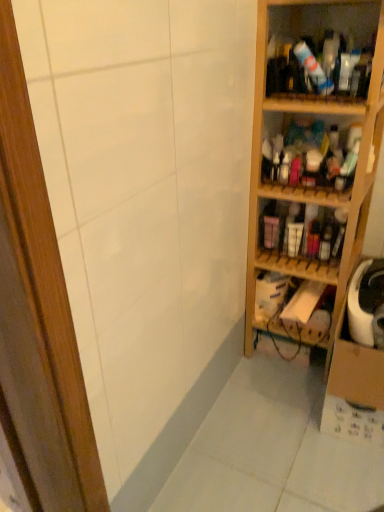
How much space does matte plastic bottles at center right, which appears as the fourth shelf when viewed from the top, occupy horizontally?

24.85 centimeters.

Image resolution: width=384 pixels, height=512 pixels. In order to click on translucent plastic bottles at upper right, which is counted as the fifth shelf, starting from the bottom in this screenshot , I will do tap(318, 42).

Image resolution: width=384 pixels, height=512 pixels. What are the coordinates of `wooden shelf at right, marked as the fifth shelf in a top-to-bottom arrangement` in the screenshot? It's located at (300, 312).

This screenshot has width=384, height=512. What do you see at coordinates (300, 312) in the screenshot? I see `wooden shelf at right, marked as the fifth shelf in a top-to-bottom arrangement` at bounding box center [300, 312].

At what (x,y) coordinates should I click in order to perform the action: click on wooden shelf at right, the 3th shelf in the top-to-bottom sequence. Please return your answer as a coordinate pair (x, y). This screenshot has width=384, height=512. Looking at the image, I should click on (311, 165).

Does point (267, 204) appear closer or farther from the camera than point (375, 88)?

Clearly, point (267, 204) is more distant from the camera than point (375, 88).

Which of these two, matte plastic bottles at center right, the 2th shelf in the bottom-to-top sequence, or wooden shelf at right, positioned as the third shelf in bottom-to-top order, stands taller?

With more height is wooden shelf at right, positioned as the third shelf in bottom-to-top order.

From a real-world perspective, is matte plastic bottles at center right, which appears as the fourth shelf when viewed from the top, located beneath wooden shelf at right, the 3th shelf in the top-to-bottom sequence?

Yes, from a real-world perspective, matte plastic bottles at center right, which appears as the fourth shelf when viewed from the top, is under wooden shelf at right, the 3th shelf in the top-to-bottom sequence.

Is point (326, 255) farther from camera compared to point (340, 56)?

Yes, point (326, 255) is farther from viewer.

Is matte plastic bottles at center right, which appears as the fourth shelf when viewed from the top, positioned with its back to translucent plastic bottles at upper right, which is counted as the fifth shelf, starting from the bottom?

No, matte plastic bottles at center right, which appears as the fourth shelf when viewed from the top, is not facing the opposite direction of translucent plastic bottles at upper right, which is counted as the fifth shelf, starting from the bottom.

Between matte plastic bottles at center right, the 2th shelf in the bottom-to-top sequence, and translucent plastic bottles at upper right, which is counted as the fifth shelf, starting from the bottom, which one has larger width?

translucent plastic bottles at upper right, which is counted as the fifth shelf, starting from the bottom, is wider.

Is wooden shelves at right, which appears as the second shelf when viewed from the top, at the right side of translucent plastic bottles at upper right, arranged as the 1th shelf when viewed from the top?

Incorrect, wooden shelves at right, which appears as the second shelf when viewed from the top, is not on the right side of translucent plastic bottles at upper right, arranged as the 1th shelf when viewed from the top.

Can you see wooden shelves at right, the 4th shelf in the bottom-to-top sequence, touching translucent plastic bottles at upper right, which is counted as the fifth shelf, starting from the bottom?

There is a gap between wooden shelves at right, the 4th shelf in the bottom-to-top sequence, and translucent plastic bottles at upper right, which is counted as the fifth shelf, starting from the bottom.

From a real-world perspective, is wooden shelves at right, the 4th shelf in the bottom-to-top sequence, located beneath translucent plastic bottles at upper right, arranged as the 1th shelf when viewed from the top?

Yes, from a real-world perspective, wooden shelves at right, the 4th shelf in the bottom-to-top sequence, is beneath translucent plastic bottles at upper right, arranged as the 1th shelf when viewed from the top.

Which of these two, wooden shelf at right, positioned as the third shelf in bottom-to-top order, or wooden shelves at right, which appears as the second shelf when viewed from the top, is thinner?

wooden shelves at right, which appears as the second shelf when viewed from the top.

From the image's perspective, relative to wooden shelves at right, which appears as the second shelf when viewed from the top, is wooden shelf at right, positioned as the third shelf in bottom-to-top order, above or below?

From the image's perspective, wooden shelf at right, positioned as the third shelf in bottom-to-top order, appears below wooden shelves at right, which appears as the second shelf when viewed from the top.

Is wooden shelf at right, positioned as the third shelf in bottom-to-top order, spatially inside wooden shelves at right, the 4th shelf in the bottom-to-top sequence, or outside of it?

wooden shelf at right, positioned as the third shelf in bottom-to-top order, is outside wooden shelves at right, the 4th shelf in the bottom-to-top sequence.

Which is in front, point (254, 257) or point (270, 146)?

The point (270, 146) is in front.

Is wooden shelf at right, which is counted as the 1th shelf, starting from the bottom, positioned beyond the bounds of wooden shelves at right, the 4th shelf in the bottom-to-top sequence?

Indeed, wooden shelf at right, which is counted as the 1th shelf, starting from the bottom, is completely outside wooden shelves at right, the 4th shelf in the bottom-to-top sequence.

Does wooden shelf at right, marked as the fifth shelf in a top-to-bottom arrangement, lie in front of wooden shelves at right, which appears as the second shelf when viewed from the top?

No, wooden shelf at right, marked as the fifth shelf in a top-to-bottom arrangement, is behind wooden shelves at right, which appears as the second shelf when viewed from the top.

Which object is thinner, wooden shelf at right, marked as the fifth shelf in a top-to-bottom arrangement, or wooden shelves at right, the 4th shelf in the bottom-to-top sequence?

wooden shelves at right, the 4th shelf in the bottom-to-top sequence.

Considering the sizes of wooden shelf at right, which is counted as the 1th shelf, starting from the bottom, and wooden shelves at right, the 4th shelf in the bottom-to-top sequence, in the image, is wooden shelf at right, which is counted as the 1th shelf, starting from the bottom, bigger or smaller than wooden shelves at right, the 4th shelf in the bottom-to-top sequence,?

In the image, wooden shelf at right, which is counted as the 1th shelf, starting from the bottom, appears to be smaller than wooden shelves at right, the 4th shelf in the bottom-to-top sequence.

Is wooden shelf at right, marked as the fifth shelf in a top-to-bottom arrangement, bigger than translucent plastic bottles at upper right, which is counted as the fifth shelf, starting from the bottom?

No, wooden shelf at right, marked as the fifth shelf in a top-to-bottom arrangement, is not bigger than translucent plastic bottles at upper right, which is counted as the fifth shelf, starting from the bottom.

Choose the correct answer: Is wooden shelf at right, marked as the fifth shelf in a top-to-bottom arrangement, inside translucent plastic bottles at upper right, which is counted as the fifth shelf, starting from the bottom, or outside it?

wooden shelf at right, marked as the fifth shelf in a top-to-bottom arrangement, exists outside the volume of translucent plastic bottles at upper right, which is counted as the fifth shelf, starting from the bottom.

Can you tell me how much wooden shelf at right, which is counted as the 1th shelf, starting from the bottom, and translucent plastic bottles at upper right, which is counted as the fifth shelf, starting from the bottom, differ in facing direction?

There is a 9.08-degree angle between the facing directions of wooden shelf at right, which is counted as the 1th shelf, starting from the bottom, and translucent plastic bottles at upper right, which is counted as the fifth shelf, starting from the bottom.

From a real-world perspective, who is located lower, wooden shelf at right, marked as the fifth shelf in a top-to-bottom arrangement, or translucent plastic bottles at upper right, arranged as the 1th shelf when viewed from the top?

In real-world perspective, wooden shelf at right, marked as the fifth shelf in a top-to-bottom arrangement, is lower.

Could you tell me if translucent plastic bottles at upper right, arranged as the 1th shelf when viewed from the top, is turned towards wooden shelf at right, marked as the fifth shelf in a top-to-bottom arrangement?

No, translucent plastic bottles at upper right, arranged as the 1th shelf when viewed from the top, is not turned towards wooden shelf at right, marked as the fifth shelf in a top-to-bottom arrangement.

Is translucent plastic bottles at upper right, which is counted as the fifth shelf, starting from the bottom, next to wooden shelf at right, marked as the fifth shelf in a top-to-bottom arrangement?

No, translucent plastic bottles at upper right, which is counted as the fifth shelf, starting from the bottom, is not beside wooden shelf at right, marked as the fifth shelf in a top-to-bottom arrangement.

Between point (279, 92) and point (298, 292), which one is positioned behind?

Point (298, 292)

From the image's perspective, is translucent plastic bottles at upper right, which is counted as the fifth shelf, starting from the bottom, located beneath wooden shelf at right, marked as the fifth shelf in a top-to-bottom arrangement?

Incorrect, from the image's perspective, translucent plastic bottles at upper right, which is counted as the fifth shelf, starting from the bottom, is higher than wooden shelf at right, marked as the fifth shelf in a top-to-bottom arrangement.

Locate an element on the screen. shelf that appears on the right of matte plastic bottles at center right, which appears as the fourth shelf when viewed from the top is located at coordinates (311, 165).

From the image's perspective, starting from the matte plastic bottles at center right, the 2th shelf in the bottom-to-top sequence, which shelf is the 3rd one above? Please provide its 2D coordinates.

[(318, 42)]

When comparing their distances from wooden shelf at right, positioned as the third shelf in bottom-to-top order, does wooden shelf at right, marked as the fifth shelf in a top-to-bottom arrangement, or translucent plastic bottles at upper right, which is counted as the fifth shelf, starting from the bottom, seem closer?

The object closer to wooden shelf at right, positioned as the third shelf in bottom-to-top order, is translucent plastic bottles at upper right, which is counted as the fifth shelf, starting from the bottom.

When comparing their distances from matte plastic bottles at center right, which appears as the fourth shelf when viewed from the top, does translucent plastic bottles at upper right, which is counted as the fifth shelf, starting from the bottom, or wooden shelves at right, which appears as the second shelf when viewed from the top, seem further?

translucent plastic bottles at upper right, which is counted as the fifth shelf, starting from the bottom, is further to matte plastic bottles at center right, which appears as the fourth shelf when viewed from the top.

Considering their positions, is wooden shelf at right, the 3th shelf in the top-to-bottom sequence, positioned further to wooden shelves at right, which appears as the second shelf when viewed from the top, than translucent plastic bottles at upper right, arranged as the 1th shelf when viewed from the top?

translucent plastic bottles at upper right, arranged as the 1th shelf when viewed from the top, lies further to wooden shelves at right, which appears as the second shelf when viewed from the top, than the other object.

Based on their spatial positions, is wooden shelf at right, positioned as the third shelf in bottom-to-top order, or translucent plastic bottles at upper right, arranged as the 1th shelf when viewed from the top, further from wooden shelf at right, which is counted as the 1th shelf, starting from the bottom?

translucent plastic bottles at upper right, arranged as the 1th shelf when viewed from the top.

Estimate the real-world distances between objects in this image. Which object is further from wooden shelf at right, positioned as the third shelf in bottom-to-top order, matte plastic bottles at center right, which appears as the fourth shelf when viewed from the top, or translucent plastic bottles at upper right, arranged as the 1th shelf when viewed from the top?

translucent plastic bottles at upper right, arranged as the 1th shelf when viewed from the top, is further to wooden shelf at right, positioned as the third shelf in bottom-to-top order.

When comparing their distances from wooden shelf at right, positioned as the third shelf in bottom-to-top order, does wooden shelves at right, the 4th shelf in the bottom-to-top sequence, or translucent plastic bottles at upper right, arranged as the 1th shelf when viewed from the top, seem further?

Among the two, translucent plastic bottles at upper right, arranged as the 1th shelf when viewed from the top, is located further to wooden shelf at right, positioned as the third shelf in bottom-to-top order.

Looking at the image, which one is located further to translucent plastic bottles at upper right, arranged as the 1th shelf when viewed from the top, wooden shelf at right, which is counted as the 1th shelf, starting from the bottom, or wooden shelf at right, positioned as the third shelf in bottom-to-top order?

The object further to translucent plastic bottles at upper right, arranged as the 1th shelf when viewed from the top, is wooden shelf at right, which is counted as the 1th shelf, starting from the bottom.

From the picture: Looking at the image, which one is located further to matte plastic bottles at center right, which appears as the fourth shelf when viewed from the top, translucent plastic bottles at upper right, arranged as the 1th shelf when viewed from the top, or wooden shelf at right, positioned as the third shelf in bottom-to-top order?

Based on the image, translucent plastic bottles at upper right, arranged as the 1th shelf when viewed from the top, appears to be further to matte plastic bottles at center right, which appears as the fourth shelf when viewed from the top.

Where is `shelf that lies between translucent plastic bottles at upper right, which is counted as the fifth shelf, starting from the bottom, and wooden shelf at right, the 3th shelf in the top-to-bottom sequence, from top to bottom`? Image resolution: width=384 pixels, height=512 pixels. shelf that lies between translucent plastic bottles at upper right, which is counted as the fifth shelf, starting from the bottom, and wooden shelf at right, the 3th shelf in the top-to-bottom sequence, from top to bottom is located at coordinates (310, 156).